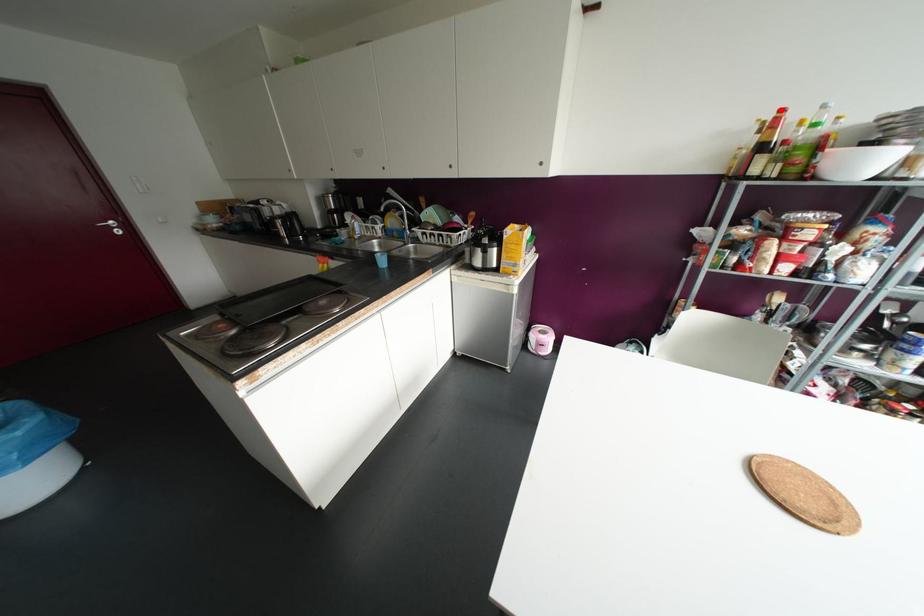
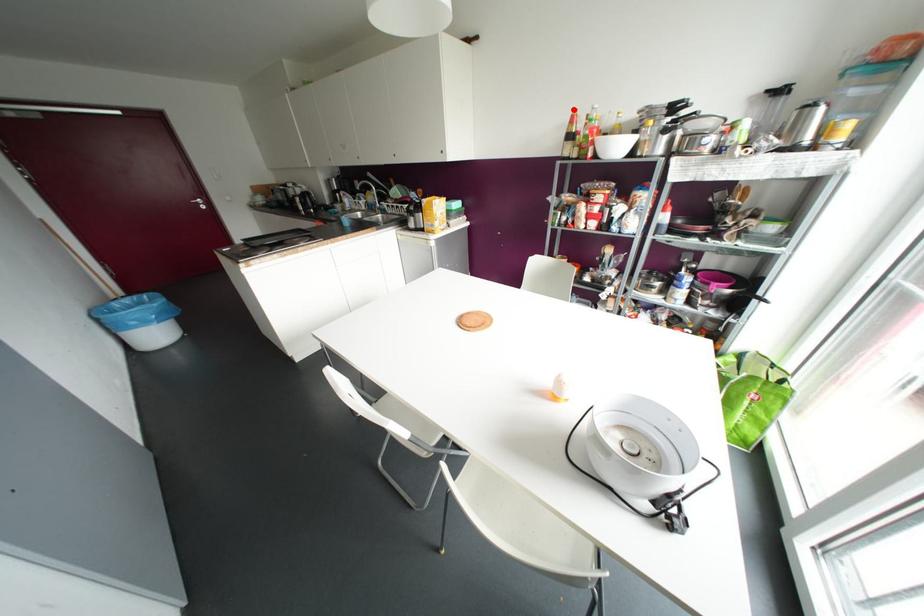
I am providing you with two images of the same scene from different viewpoints. A red point is marked on the first image and another point is marked on the second image. Is the marked point in image1 the same physical position as the marked point in image2?

Yes